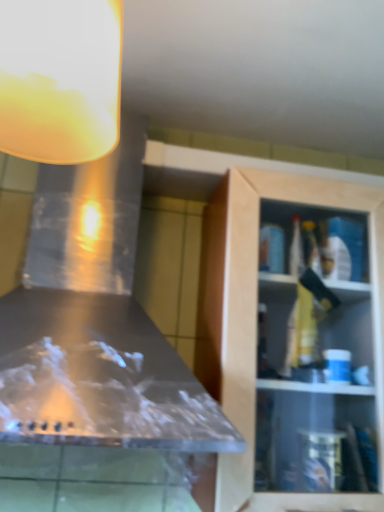
Locate an element on the screen. wooden cabinet at right is located at coordinates (256, 315).

This screenshot has width=384, height=512. What do you see at coordinates (256, 315) in the screenshot? I see `wooden cabinet at right` at bounding box center [256, 315].

Based on the photo, in order to face wooden cabinet at right, should I rotate leftwards or rightwards?

A 17.257 degree turn to the right will do.

This screenshot has height=512, width=384. I want to click on translucent glass lampshade at upper left, so click(x=60, y=79).

What do you see at coordinates (60, 79) in the screenshot? I see `translucent glass lampshade at upper left` at bounding box center [60, 79].

I want to click on wooden cabinet at right, so click(x=256, y=315).

Is translucent glass lampshade at upper left at the left side of wooden cabinet at right?

Correct, you'll find translucent glass lampshade at upper left to the left of wooden cabinet at right.

Between translucent glass lampshade at upper left and wooden cabinet at right, which one is positioned in front?

translucent glass lampshade at upper left is in front.

Considering the points (37, 37) and (222, 337), which point is in front, point (37, 37) or point (222, 337)?

The point (37, 37) is more forward.

From the image's perspective, is translucent glass lampshade at upper left located above or below wooden cabinet at right?

translucent glass lampshade at upper left is above wooden cabinet at right.

From a real-world perspective, who is located higher, translucent glass lampshade at upper left or wooden cabinet at right?

In real-world perspective, translucent glass lampshade at upper left is above.

Is translucent glass lampshade at upper left thinner than wooden cabinet at right?

Correct, the width of translucent glass lampshade at upper left is less than that of wooden cabinet at right.

Between translucent glass lampshade at upper left and wooden cabinet at right, which one has more height?

Standing taller between the two is wooden cabinet at right.

Between translucent glass lampshade at upper left and wooden cabinet at right, which one has larger size?

wooden cabinet at right is bigger.

Is wooden cabinet at right located within translucent glass lampshade at upper left?

That's incorrect, wooden cabinet at right is not inside translucent glass lampshade at upper left.

Is translucent glass lampshade at upper left positioned far away from wooden cabinet at right?

translucent glass lampshade at upper left is near wooden cabinet at right, not far away.

Is translucent glass lampshade at upper left oriented away from wooden cabinet at right?

No, translucent glass lampshade at upper left is not facing away from wooden cabinet at right.

The width and height of the screenshot is (384, 512). What are the coordinates of `light fixture on the left of wooden cabinet at right` in the screenshot? It's located at (60, 79).

Visually, is wooden cabinet at right positioned to the left or to the right of translucent glass lampshade at upper left?

In the image, wooden cabinet at right appears on the right side of translucent glass lampshade at upper left.

Looking at this image, is wooden cabinet at right in front of or behind translucent glass lampshade at upper left in the image?

wooden cabinet at right is positioned farther from the viewer than translucent glass lampshade at upper left.

Which point is more forward, (246, 298) or (113, 133)?

Point (113, 133)

From the image's perspective, is wooden cabinet at right positioned above or below translucent glass lampshade at upper left?

wooden cabinet at right is situated lower than translucent glass lampshade at upper left in the image.

From a real-world perspective, is wooden cabinet at right on top of translucent glass lampshade at upper left?

Actually, wooden cabinet at right is physically below translucent glass lampshade at upper left in the real world.

Looking at their sizes, would you say wooden cabinet at right is wider or thinner than translucent glass lampshade at upper left?

In the image, wooden cabinet at right appears to be wider than translucent glass lampshade at upper left.

Considering the relative sizes of wooden cabinet at right and translucent glass lampshade at upper left in the image provided, is wooden cabinet at right shorter than translucent glass lampshade at upper left?

No, wooden cabinet at right is not shorter than translucent glass lampshade at upper left.

Can you confirm if wooden cabinet at right is bigger than translucent glass lampshade at upper left?

Indeed, wooden cabinet at right has a larger size compared to translucent glass lampshade at upper left.

Do you think wooden cabinet at right is within translucent glass lampshade at upper left, or outside of it?

wooden cabinet at right is spatially situated outside translucent glass lampshade at upper left.

Would you say wooden cabinet at right is a long distance from translucent glass lampshade at upper left?

No, wooden cabinet at right is not far from translucent glass lampshade at upper left.

Is wooden cabinet at right aimed at translucent glass lampshade at upper left?

No, wooden cabinet at right is not turned towards translucent glass lampshade at upper left.

How far apart are wooden cabinet at right and translucent glass lampshade at upper left?

wooden cabinet at right is 20.09 inches away from translucent glass lampshade at upper left.

Image resolution: width=384 pixels, height=512 pixels. I want to click on light fixture on the left of the wooden cabinet at right, so click(60, 79).

Locate an element on the screen. The width and height of the screenshot is (384, 512). cabinetry directly beneath the translucent glass lampshade at upper left (from a real-world perspective) is located at coordinates (256, 315).

I want to click on light fixture located on the left of wooden cabinet at right, so click(60, 79).